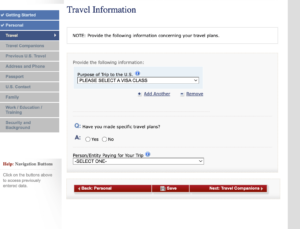
At what (x,y) coordinates should I click in order to perform the action: click on note box. Please return your answer as a coordinate pair (x, y). Looking at the image, I should click on (81, 35).